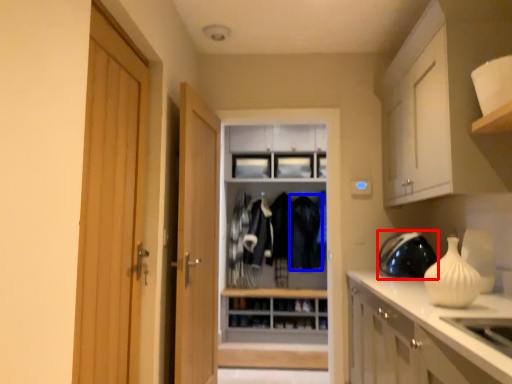
Question: Which point is further to the camera, appliance (highlighted by a red box) or clothing (highlighted by a blue box)?

Choices:
 (A) appliance
 (B) clothing

Answer: (B)